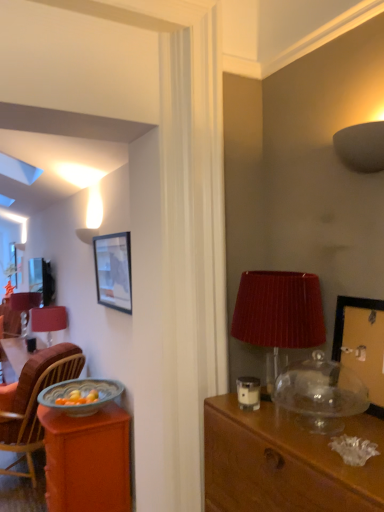
What do you see at coordinates (279, 310) in the screenshot?
I see `matte red lampshade at right, positioned as the 2th lamp in front-to-back order` at bounding box center [279, 310].

Locate an element on the screen. matte red lampshade at right, which ranks as the 2th lamp in right-to-left order is located at coordinates (279, 310).

In the scene shown: In order to face orange wood desk at left, the 2th desk in the front-to-back sequence, should I rotate leftwards or rightwards?

A 14.247 degree turn to the left will do.

Find the location of `orange wood desk at left, which ranks as the 1th desk in left-to-right order`. orange wood desk at left, which ranks as the 1th desk in left-to-right order is located at coordinates (87, 460).

In order to click on matte red lampshade at left, which is the 1th lamp from left to right in this screenshot , I will do `click(48, 320)`.

Locate an element on the screen. The height and width of the screenshot is (512, 384). matte red table lamp at left is located at coordinates (24, 306).

Locate an element on the screen. matte black picture frame at upper left, the 1th picture frame from the left is located at coordinates (113, 271).

Is wooden picture frame at upper right, positioned as the first picture frame in right-to-left order, a part of wooden desk at right, which appears as the 2th desk when ordered from the bottom?

No, wooden desk at right, which appears as the 2th desk when ordered from the bottom, does not contain wooden picture frame at upper right, positioned as the first picture frame in right-to-left order.

This screenshot has width=384, height=512. I want to click on the 1st desk to the left of the wooden picture frame at upper right, the 1th picture frame from the front, starting your count from the anchor, so click(284, 462).

Is wooden desk at right, which is the 1th desk from top to bottom, facing away from wooden picture frame at upper right, positioned as the 2th picture frame in left-to-right order?

No, wooden desk at right, which is the 1th desk from top to bottom, is not facing the opposite direction of wooden picture frame at upper right, positioned as the 2th picture frame in left-to-right order.

Is the depth of wooden desk at right, which is the 1th desk from top to bottom, less than that of wooden picture frame at upper right, positioned as the 2th picture frame in left-to-right order?

Yes, the depth of wooden desk at right, which is the 1th desk from top to bottom, is less than that of wooden picture frame at upper right, positioned as the 2th picture frame in left-to-right order.

Does wooden picture frame at upper right, positioned as the first picture frame in right-to-left order, turn towards matte red lampshade at right, the second lamp when ordered from left to right?

No, wooden picture frame at upper right, positioned as the first picture frame in right-to-left order, is not aimed at matte red lampshade at right, the second lamp when ordered from left to right.

From the image's perspective, would you say wooden picture frame at upper right, marked as the second picture frame in a back-to-front arrangement, is shown under matte red lampshade at right, the second lamp when ordered from left to right?

Yes.

Is wooden picture frame at upper right, positioned as the 2th picture frame in left-to-right order, smaller than matte red lampshade at right, positioned as the 2th lamp in front-to-back order?

Yes, wooden picture frame at upper right, positioned as the 2th picture frame in left-to-right order, is smaller than matte red lampshade at right, positioned as the 2th lamp in front-to-back order.

Is matte red lampshade at right, the second lamp when ordered from left to right, behind translucent glass bowl at lower left?

No, it is in front of translucent glass bowl at lower left.

Is matte red lampshade at right, the second lamp from the top, in contact with translucent glass bowl at lower left?

No, matte red lampshade at right, the second lamp from the top, is not touching translucent glass bowl at lower left.

Does matte red lampshade at right, positioned as the 2th lamp in front-to-back order, have a larger size compared to translucent glass bowl at lower left?

Correct, matte red lampshade at right, positioned as the 2th lamp in front-to-back order, is larger in size than translucent glass bowl at lower left.

Considering the relative positions of matte red lampshade at right, positioned as the second lamp in back-to-front order, and translucent glass bowl at lower left in the image provided, is matte red lampshade at right, positioned as the second lamp in back-to-front order, to the left of translucent glass bowl at lower left from the viewer's perspective?

No.

I want to click on the 3rd lamp to the right of the matte red table lamp at left, starting your count from the anchor, so click(x=361, y=146).

From a real-world perspective, relative to matte red table lamp at left, is matte gray lampshade at upper right, the first lamp when ordered from top to bottom, vertically above or below?

matte gray lampshade at upper right, the first lamp when ordered from top to bottom, is situated higher than matte red table lamp at left in the real world.

How many degrees apart are the facing directions of matte gray lampshade at upper right, the third lamp in the left-to-right sequence, and matte red table lamp at left?

There is a 0.706-degree angle between the facing directions of matte gray lampshade at upper right, the third lamp in the left-to-right sequence, and matte red table lamp at left.

From the image's perspective, which one is positioned higher, matte gray lampshade at upper right, the third lamp in the left-to-right sequence, or matte red table lamp at left?

From the image's view, matte gray lampshade at upper right, the third lamp in the left-to-right sequence, is above.

Is matte gray lampshade at upper right, arranged as the first lamp when viewed from the front, completely or partially outside of matte red lampshade at right, the second lamp from the top?

That's correct, matte gray lampshade at upper right, arranged as the first lamp when viewed from the front, is outside of matte red lampshade at right, the second lamp from the top.

From a real-world perspective, is matte gray lampshade at upper right, the third lamp in the left-to-right sequence, positioned over matte red lampshade at right, positioned as the second lamp in back-to-front order, based on gravity?

Yes, from a real-world perspective, matte gray lampshade at upper right, the third lamp in the left-to-right sequence, is over matte red lampshade at right, positioned as the second lamp in back-to-front order

Which is in front, point (379, 130) or point (245, 280)?

The point (379, 130) is in front.

Would you say wooden chair at left is outside wooden picture frame at upper right, the 1th picture frame from the front?

Yes.

From their relative heights in the image, would you say wooden chair at left is taller or shorter than wooden picture frame at upper right, positioned as the 2th picture frame in left-to-right order?

Considering their sizes, wooden chair at left has more height than wooden picture frame at upper right, positioned as the 2th picture frame in left-to-right order.

From a real-world perspective, is wooden chair at left physically above wooden picture frame at upper right, positioned as the 2th picture frame in left-to-right order?

No, from a real-world perspective, wooden chair at left is not on top of wooden picture frame at upper right, positioned as the 2th picture frame in left-to-right order.

Is point (60, 346) positioned behind point (349, 320)?

Yes, point (60, 346) is farther from viewer.

Would you say wooden chair at left is to the left or to the right of matte red table lamp at left in the picture?

wooden chair at left is positioned on matte red table lamp at left's right side.

Is wooden chair at left closer to camera compared to matte red table lamp at left?

That is True.

Looking at their sizes, would you say wooden chair at left is wider or thinner than matte red table lamp at left?

wooden chair at left is wider than matte red table lamp at left.

Is wooden chair at left far from matte red table lamp at left?

Absolutely, wooden chair at left is distant from matte red table lamp at left.

From the wooden desk at right, which appears as the 2th desk when viewed from the left, count 1st picture frames backward and point to it. Please provide its 2D coordinates.

[(362, 343)]

I want to click on the 2nd lamp counting from the left of the wooden picture frame at upper right, positioned as the first picture frame in right-to-left order, so click(279, 310).

Based on their spatial positions, is matte red table lamp at left or orange wood desk at left, placed as the first desk when sorted from bottom to top, closer to matte red lampshade at right, positioned as the second lamp in back-to-front order?

Among the two, orange wood desk at left, placed as the first desk when sorted from bottom to top, is located nearer to matte red lampshade at right, positioned as the second lamp in back-to-front order.

Looking at the image, which one is located further to matte gray lampshade at upper right, marked as the third lamp in a bottom-to-top arrangement, wooden chair at left or translucent glass bowl at lower left?

wooden chair at left.

Considering their positions, is wooden chair at left positioned further to wooden picture frame at upper right, the 1th picture frame from the front, than orange wood desk at left, the 1th desk from the back?

wooden chair at left is positioned further to the anchor wooden picture frame at upper right, the 1th picture frame from the front.

When comparing their distances from wooden desk at right, which ranks as the 2th desk in back-to-front order, does wooden chair at left or translucent glass bowl at lower left seem closer?

translucent glass bowl at lower left.

Based on their spatial positions, is wooden desk at right, the first desk in the front-to-back sequence, or translucent glass bowl at lower left further from orange wood desk at left, which is counted as the 2th desk, starting from the top?

The object further to orange wood desk at left, which is counted as the 2th desk, starting from the top, is wooden desk at right, the first desk in the front-to-back sequence.

Looking at the image, which one is located further to matte red lampshade at left, which is the 1th lamp in bottom-to-top order, wooden desk at right, which ranks as the 2th desk in back-to-front order, or wooden chair at left?

wooden desk at right, which ranks as the 2th desk in back-to-front order, lies further to matte red lampshade at left, which is the 1th lamp in bottom-to-top order, than the other object.

Considering their positions, is orange wood desk at left, which ranks as the 1th desk in left-to-right order, positioned further to matte black picture frame at upper left, the 2th picture frame when ordered from right to left, than matte gray lampshade at upper right, the first lamp when ordered from top to bottom?

The object further to matte black picture frame at upper left, the 2th picture frame when ordered from right to left, is matte gray lampshade at upper right, the first lamp when ordered from top to bottom.

From the image, which object appears to be farther from wooden picture frame at upper right, positioned as the 2th picture frame in left-to-right order, matte black picture frame at upper left, placed as the first picture frame when sorted from back to front, or wooden chair at left?

Based on the image, wooden chair at left appears to be further to wooden picture frame at upper right, positioned as the 2th picture frame in left-to-right order.

Find the location of a particular element. desk between wooden picture frame at upper right, the 1th picture frame from the front, and matte red table lamp at left in the front-back direction is located at coordinates (87, 460).

Locate an element on the screen. picture frame positioned between wooden desk at right, the 1th desk when ordered from right to left, and matte black picture frame at upper left, which is the 2th picture frame in front-to-back order, from near to far is located at coordinates (362, 343).

I want to click on picture frame between matte red lampshade at right, positioned as the 2th lamp in front-to-back order, and wooden desk at right, which appears as the 2th desk when ordered from the bottom, in the up-down direction, so click(362, 343).

At what (x,y) coordinates should I click in order to perform the action: click on bowl located between wooden chair at left and matte red lampshade at right, the second lamp when ordered from left to right, in the left-right direction. Please return your answer as a coordinate pair (x, y). Looking at the image, I should click on (80, 395).